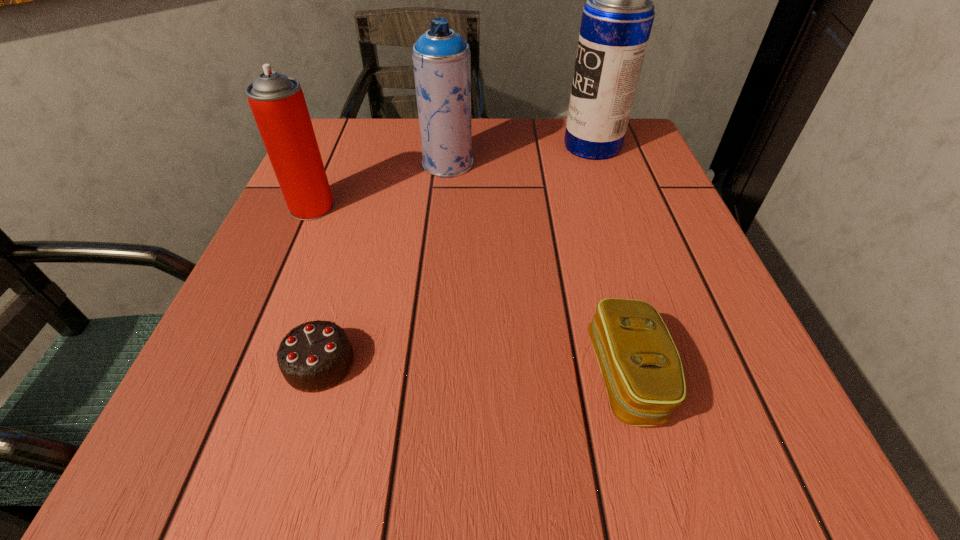
The image size is (960, 540). What are the coordinates of `vacant area that lies between the leftmost object and the chocolate cake` in the screenshot? It's located at (316, 285).

Where is `free space between the clutch bag and the second object from left to right`? The height and width of the screenshot is (540, 960). free space between the clutch bag and the second object from left to right is located at coordinates (473, 369).

The height and width of the screenshot is (540, 960). I want to click on blank region between the leftmost aerosol can and the second aerosol can from left to right, so click(380, 185).

The image size is (960, 540). Identify the location of vacant space in between the second aerosol can from left to right and the clutch bag. (538, 269).

The width and height of the screenshot is (960, 540). I want to click on empty space that is in between the third object from left to right and the clutch bag, so click(538, 269).

Image resolution: width=960 pixels, height=540 pixels. I want to click on free space between the third object from left to right and the fourth object from right to left, so pos(384,264).

The width and height of the screenshot is (960, 540). I want to click on free space between the third object from left to right and the leftmost object, so click(x=380, y=185).

This screenshot has width=960, height=540. Find the location of `free space that is in between the third object from left to right and the clutch bag`. free space that is in between the third object from left to right and the clutch bag is located at coordinates (538, 269).

Locate an element on the screen. The width and height of the screenshot is (960, 540). free space between the clutch bag and the tallest aerosol can is located at coordinates (610, 261).

Image resolution: width=960 pixels, height=540 pixels. Find the location of `free area in between the clutch bag and the tallest object`. free area in between the clutch bag and the tallest object is located at coordinates (610, 261).